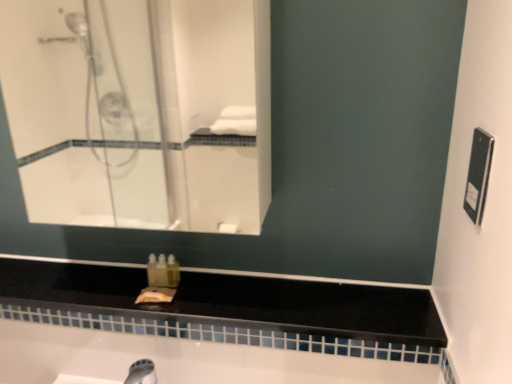
Question: Is black matte counter top at center smaller than white glass mirror at upper left?

Choices:
 (A) yes
 (B) no

Answer: (A)

Question: Does black matte counter top at center have a larger size compared to white glass mirror at upper left?

Choices:
 (A) yes
 (B) no

Answer: (B)

Question: From a real-world perspective, is black matte counter top at center under white glass mirror at upper left?

Choices:
 (A) yes
 (B) no

Answer: (A)

Question: Are black matte counter top at center and white glass mirror at upper left beside each other?

Choices:
 (A) no
 (B) yes

Answer: (A)

Question: Considering the relative positions of black matte counter top at center and white glass mirror at upper left in the image provided, is black matte counter top at center in front of white glass mirror at upper left?

Choices:
 (A) yes
 (B) no

Answer: (B)

Question: Is there a large distance between black matte counter top at center and white glass mirror at upper left?

Choices:
 (A) no
 (B) yes

Answer: (B)

Question: Does white glass mirror at upper left have a lesser width compared to black matte counter top at center?

Choices:
 (A) yes
 (B) no

Answer: (A)

Question: Is white glass mirror at upper left directly adjacent to black matte counter top at center?

Choices:
 (A) no
 (B) yes

Answer: (A)

Question: Is white glass mirror at upper left not within black matte counter top at center?

Choices:
 (A) yes
 (B) no

Answer: (A)

Question: From the image's perspective, is white glass mirror at upper left below black matte counter top at center?

Choices:
 (A) no
 (B) yes

Answer: (A)

Question: Can you confirm if white glass mirror at upper left is taller than black matte counter top at center?

Choices:
 (A) yes
 (B) no

Answer: (A)

Question: Is white glass mirror at upper left shorter than black matte counter top at center?

Choices:
 (A) yes
 (B) no

Answer: (B)

Question: From a real-world perspective, is white glass mirror at upper left above or below black matte counter top at center?

Choices:
 (A) above
 (B) below

Answer: (A)